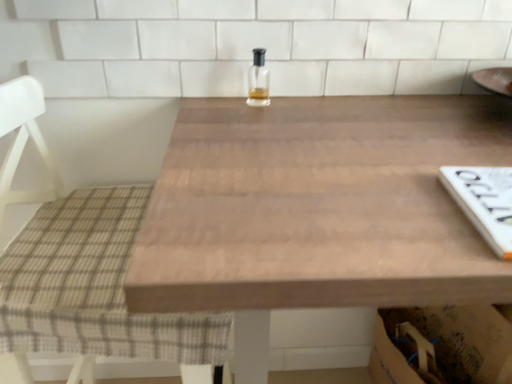
What do you see at coordinates (91, 292) in the screenshot? I see `plaid fabric chair at left` at bounding box center [91, 292].

What do you see at coordinates (258, 80) in the screenshot? I see `clear glass bottle at center` at bounding box center [258, 80].

The image size is (512, 384). I want to click on wooden table at center, so click(317, 211).

Based on the photo, is clear glass bottle at center with wooden table at center?

No, clear glass bottle at center is not with wooden table at center.

From the image's perspective, between clear glass bottle at center and wooden table at center, which one is located above?

clear glass bottle at center.

Based on the photo, what's the angular difference between clear glass bottle at center and wooden table at center's facing directions?

There is a 4.1-degree angle between the facing directions of clear glass bottle at center and wooden table at center.

Is clear glass bottle at center positioned with its back to wooden table at center?

That's not correct — clear glass bottle at center is not looking away from wooden table at center.

Which object is closer to the camera, wooden table at center or plaid fabric chair at left?

wooden table at center is closer to the camera.

From a real-world perspective, is wooden table at center above or below plaid fabric chair at left?

In terms of real-world spatial position, wooden table at center is below plaid fabric chair at left.

Considering the sizes of wooden table at center and plaid fabric chair at left in the image, is wooden table at center bigger or smaller than plaid fabric chair at left?

In the image, wooden table at center appears to be larger than plaid fabric chair at left.

Does point (237, 305) come behind point (129, 244)?

No, it is in front of (129, 244).

From a real-world perspective, is clear glass bottle at center physically located above or below plaid fabric chair at left?

Clearly, from a real-world perspective, clear glass bottle at center is above plaid fabric chair at left.

Looking at this image, between clear glass bottle at center and plaid fabric chair at left, which one has smaller size?

With smaller size is clear glass bottle at center.

Is clear glass bottle at center taller than plaid fabric chair at left?

No.

Does clear glass bottle at center appear on the right side of plaid fabric chair at left?

Correct, you'll find clear glass bottle at center to the right of plaid fabric chair at left.

Is plaid fabric chair at left oriented away from clear glass bottle at center?

No, plaid fabric chair at left is not facing the opposite direction of clear glass bottle at center.

What's the angular difference between plaid fabric chair at left and clear glass bottle at center's facing directions?

The facing directions of plaid fabric chair at left and clear glass bottle at center are 94.1 degrees apart.

From the image's perspective, is plaid fabric chair at left below clear glass bottle at center?

Indeed, from the image's perspective, plaid fabric chair at left is shown beneath clear glass bottle at center.

In the image, is wooden table at center positioned in front of or behind clear glass bottle at center?

Visually, wooden table at center is located in front of clear glass bottle at center.

Do you think wooden table at center is within clear glass bottle at center, or outside of it?

wooden table at center exists outside the volume of clear glass bottle at center.

Are wooden table at center and clear glass bottle at center beside each other?

There is a gap between wooden table at center and clear glass bottle at center.

Between plaid fabric chair at left and wooden table at center, which one is positioned behind?

plaid fabric chair at left is more distant.

From the image's perspective, is plaid fabric chair at left located beneath wooden table at center?

No.

Is plaid fabric chair at left turned away from wooden table at center?

That's not correct — plaid fabric chair at left is not looking away from wooden table at center.

Is plaid fabric chair at left thinner than wooden table at center?

Indeed, plaid fabric chair at left has a lesser width compared to wooden table at center.

I want to click on table lying on the right of clear glass bottle at center, so click(317, 211).

Identify the location of chair behind the wooden table at center. (91, 292).

When comparing their distances from wooden table at center, does clear glass bottle at center or plaid fabric chair at left seem further?

Based on the image, clear glass bottle at center appears to be further to wooden table at center.

From the image, which object appears to be nearer to plaid fabric chair at left, clear glass bottle at center or wooden table at center?

wooden table at center lies closer to plaid fabric chair at left than the other object.

Looking at the image, which one is located further to wooden table at center, plaid fabric chair at left or clear glass bottle at center?

clear glass bottle at center lies further to wooden table at center than the other object.

Looking at this image, estimate the real-world distances between objects in this image. Which object is further from clear glass bottle at center, wooden table at center or plaid fabric chair at left?

The object further to clear glass bottle at center is plaid fabric chair at left.

Based on their spatial positions, is wooden table at center or clear glass bottle at center further from plaid fabric chair at left?

Among the two, clear glass bottle at center is located further to plaid fabric chair at left.

Based on their spatial positions, is plaid fabric chair at left or wooden table at center further from clear glass bottle at center?

plaid fabric chair at left lies further to clear glass bottle at center than the other object.

Find the location of a particular element. This screenshot has height=384, width=512. bottle between plaid fabric chair at left and wooden table at center in the horizontal direction is located at coordinates (258, 80).